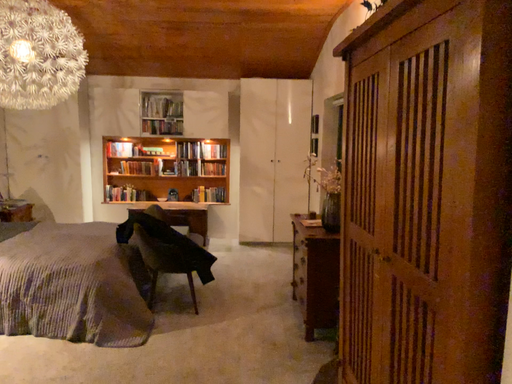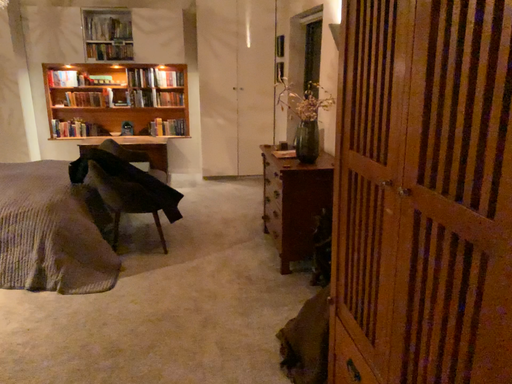
Question: How did the camera likely rotate when shooting the video?

Choices:
 (A) rotated upward
 (B) rotated downward

Answer: (B)